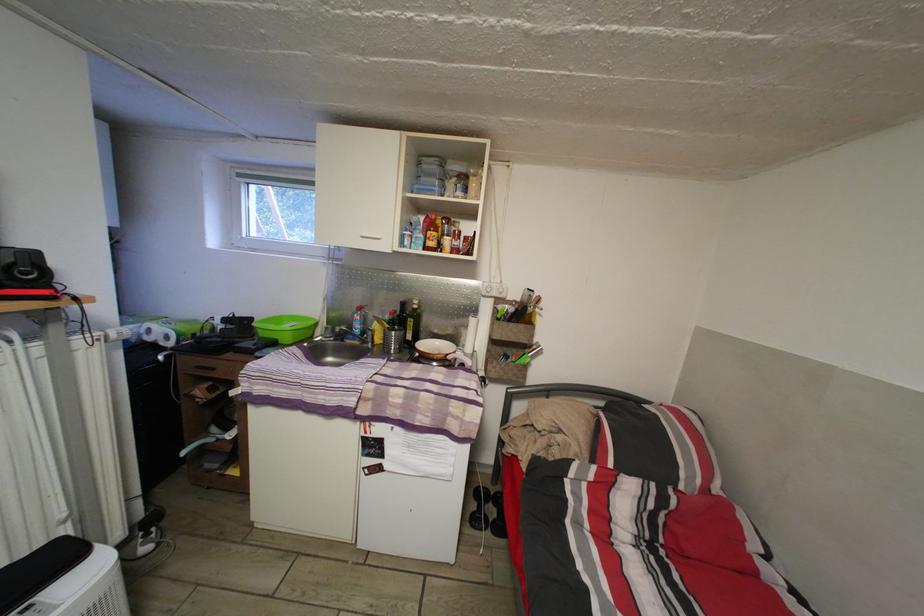
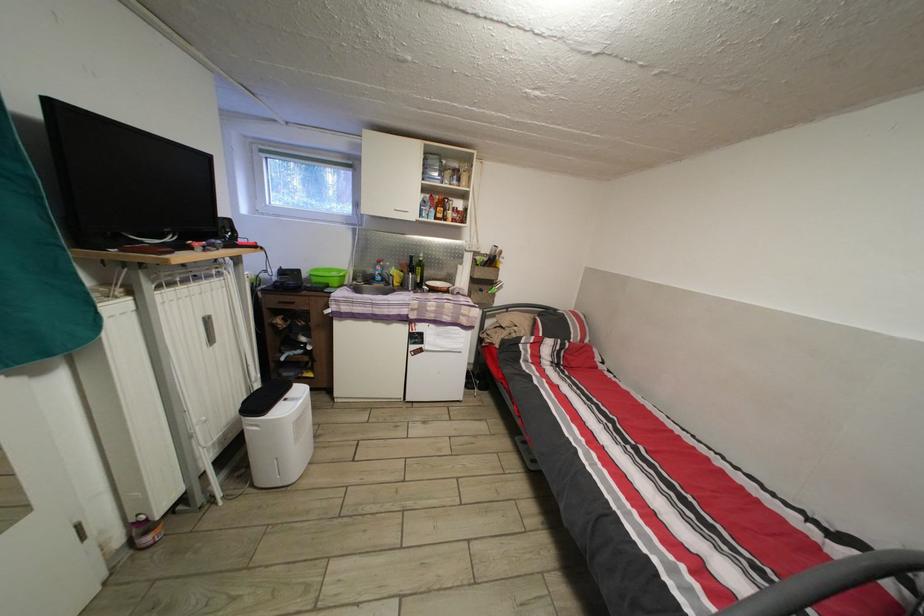
Where in the second image is the point corresponding to point (435, 238) from the first image?

(445, 215)